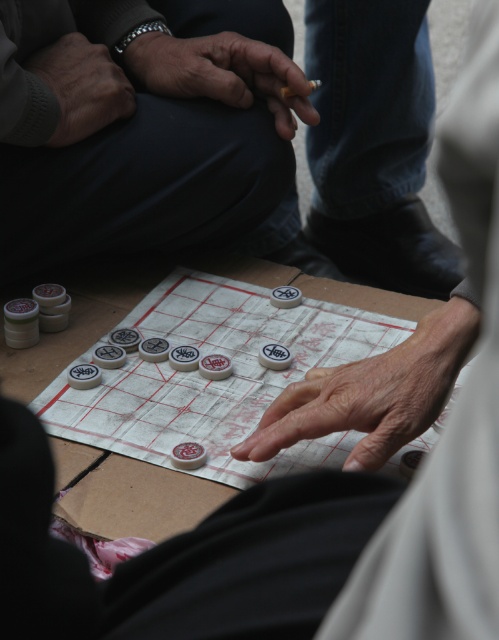
Question: Can you confirm if smooth skin hand at center is positioned to the left of matte black hand at upper center?

Choices:
 (A) yes
 (B) no

Answer: (B)

Question: Considering the real-world distances, which object is closest to the white glossy checkers at center?

Choices:
 (A) smooth skin hand at center
 (B) smooth brown cigarette at center
 (C) matte black hand at upper center
 (D) gray knit sweater at upper left

Answer: (A)

Question: Does smooth skin hand at center appear under matte black hand at upper center?

Choices:
 (A) no
 (B) yes

Answer: (B)

Question: Can you confirm if smooth skin hand at center is positioned below smooth brown cigarette at center?

Choices:
 (A) no
 (B) yes

Answer: (B)

Question: Which of these objects is positioned farthest from the gray knit sweater at upper left?

Choices:
 (A) smooth brown cigarette at center
 (B) smooth skin hand at center
 (C) white glossy checkers at center

Answer: (B)

Question: Among these points, which one is nearest to the camera?

Choices:
 (A) (465, 336)
 (B) (317, 77)
 (C) (76, 70)
 (D) (218, 84)

Answer: (A)